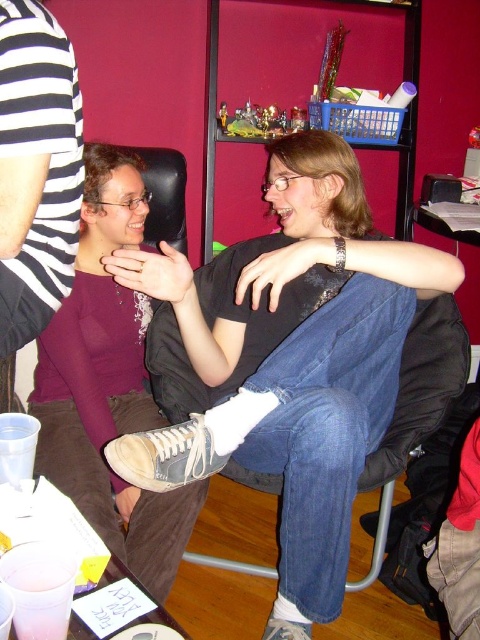
You are standing in the room and see two points marked in the image. Which point is closer to you, point (x=395, y=273) or point (x=71, y=380)?

Point (x=395, y=273) is in front of point (x=71, y=380), so it is closer to you.

You are designing a new seating arrangement for a small office space. You have two items to consider for placement between two chairs facing each other. The items are the denim jeans at center and the matte purple sweater at center. Based on their widths, which item would you choose to place between the two chairs to ensure there is enough space for both items without overcrowding the area?

The denim jeans at center might be wider than the matte purple sweater at center, so choosing the matte purple sweater at center would leave more space between the two chairs, preventing overcrowding.